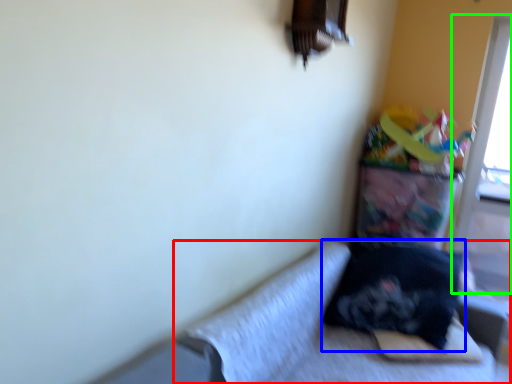
Question: Estimate the real-world distances between objects in this image. Which object is farther from studio couch (highlighted by a red box), pillow (highlighted by a blue box) or screen door (highlighted by a green box)?

Choices:
 (A) pillow
 (B) screen door

Answer: (B)